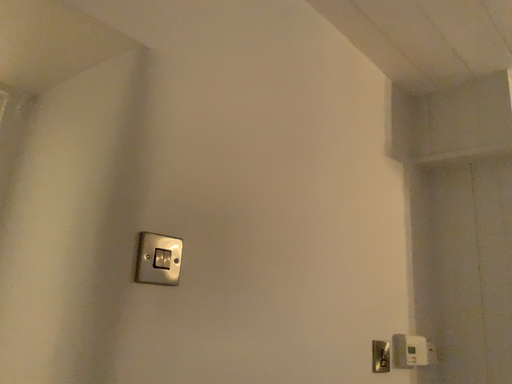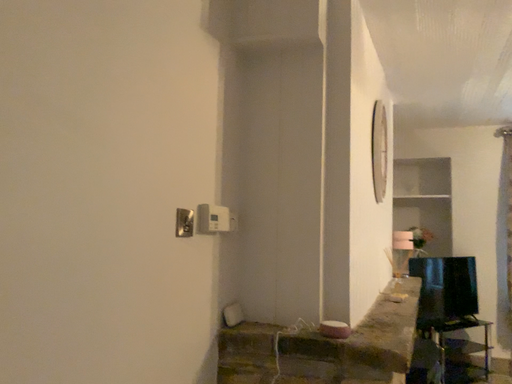
Question: Which way did the camera rotate in the video?

Choices:
 (A) rotated upward
 (B) rotated downward

Answer: (B)